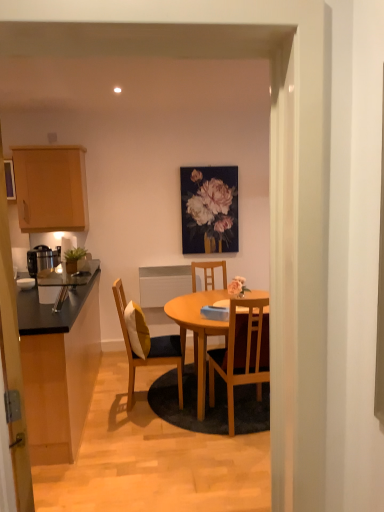
Question: From the image's perspective, does matte floral painting at upper center appear higher than wooden chair at center, which ranks as the 1th chair in back-to-front order?

Choices:
 (A) no
 (B) yes

Answer: (B)

Question: Considering the relative sizes of matte floral painting at upper center and wooden chair at center, the 2th chair in the right-to-left sequence, in the image provided, is matte floral painting at upper center thinner than wooden chair at center, the 2th chair in the right-to-left sequence,?

Choices:
 (A) no
 (B) yes

Answer: (B)

Question: From a real-world perspective, is matte floral painting at upper center located beneath wooden chair at center, which ranks as the 1th chair in back-to-front order?

Choices:
 (A) yes
 (B) no

Answer: (B)

Question: Is matte floral painting at upper center at the right side of wooden chair at center, which ranks as the 1th chair in back-to-front order?

Choices:
 (A) yes
 (B) no

Answer: (A)

Question: From the image's perspective, is matte floral painting at upper center located beneath wooden chair at center, the 2th chair in the right-to-left sequence?

Choices:
 (A) no
 (B) yes

Answer: (A)

Question: Can you confirm if matte floral painting at upper center is wider than wooden chair at center, which ranks as the 2th chair in left-to-right order?

Choices:
 (A) no
 (B) yes

Answer: (A)

Question: Can you confirm if wooden chair with cushion at center, the 2th chair when ordered from front to back, is shorter than matte floral painting at upper center?

Choices:
 (A) yes
 (B) no

Answer: (B)

Question: Can you confirm if wooden chair with cushion at center, the third chair viewed from the right, is taller than matte floral painting at upper center?

Choices:
 (A) yes
 (B) no

Answer: (A)

Question: Considering the relative sizes of wooden chair with cushion at center, positioned as the first chair in left-to-right order, and matte floral painting at upper center in the image provided, is wooden chair with cushion at center, positioned as the first chair in left-to-right order, thinner than matte floral painting at upper center?

Choices:
 (A) no
 (B) yes

Answer: (A)

Question: Does wooden chair with cushion at center, the third chair viewed from the right, appear on the right side of matte floral painting at upper center?

Choices:
 (A) yes
 (B) no

Answer: (B)

Question: From a real-world perspective, does wooden chair with cushion at center, positioned as the first chair in left-to-right order, sit lower than matte floral painting at upper center?

Choices:
 (A) yes
 (B) no

Answer: (A)

Question: Does wooden chair with cushion at center, the 2th chair when ordered from front to back, appear on the left side of matte floral painting at upper center?

Choices:
 (A) yes
 (B) no

Answer: (A)

Question: Are wooden chair with cushion at center, the 2th chair when ordered from front to back, and wooden chair at center, which ranks as the 1th chair in back-to-front order, located far from each other?

Choices:
 (A) yes
 (B) no

Answer: (B)